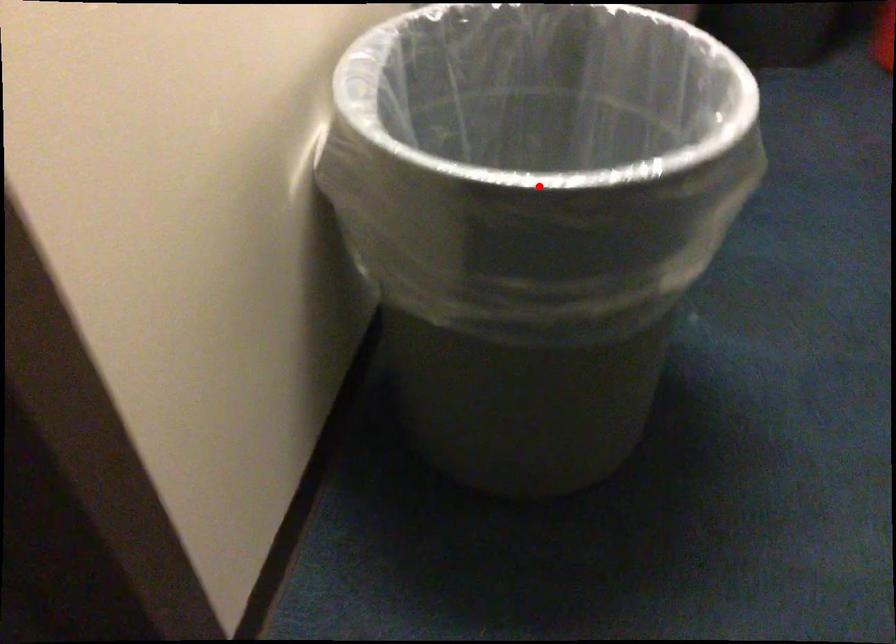
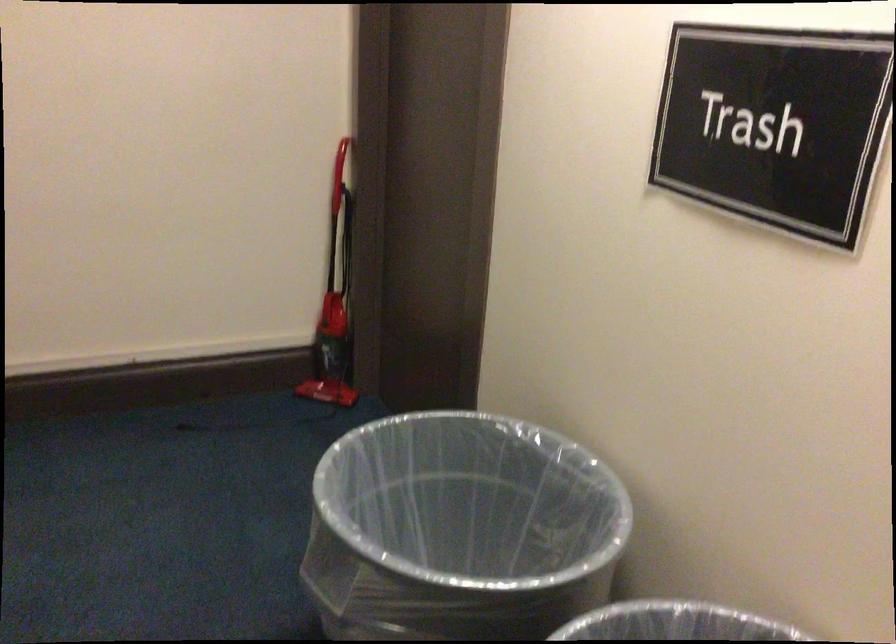
Question: I am providing you with two images of the same scene from different viewpoints. A red point is marked on the first image. Is the red point's position out of view in image 2?

Choices:
 (A) Yes
 (B) No

Answer: (A)